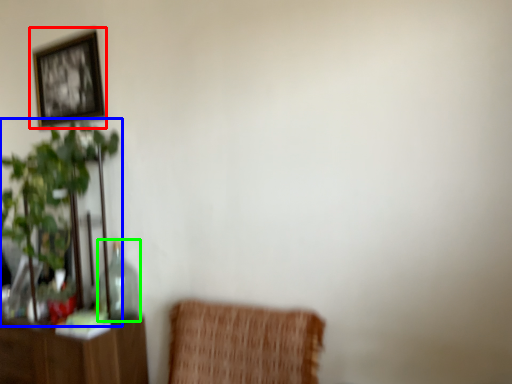
Question: Which object is positioned farthest from picture frame (highlighted by a red box)? Select from houseplant (highlighted by a blue box) and glass vase (highlighted by a green box).

Choices:
 (A) houseplant
 (B) glass vase

Answer: (B)